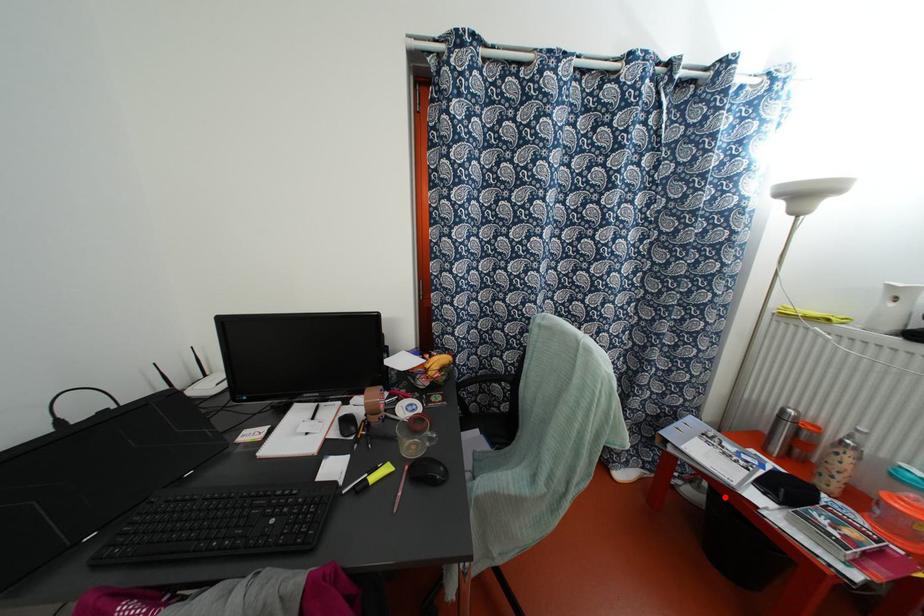
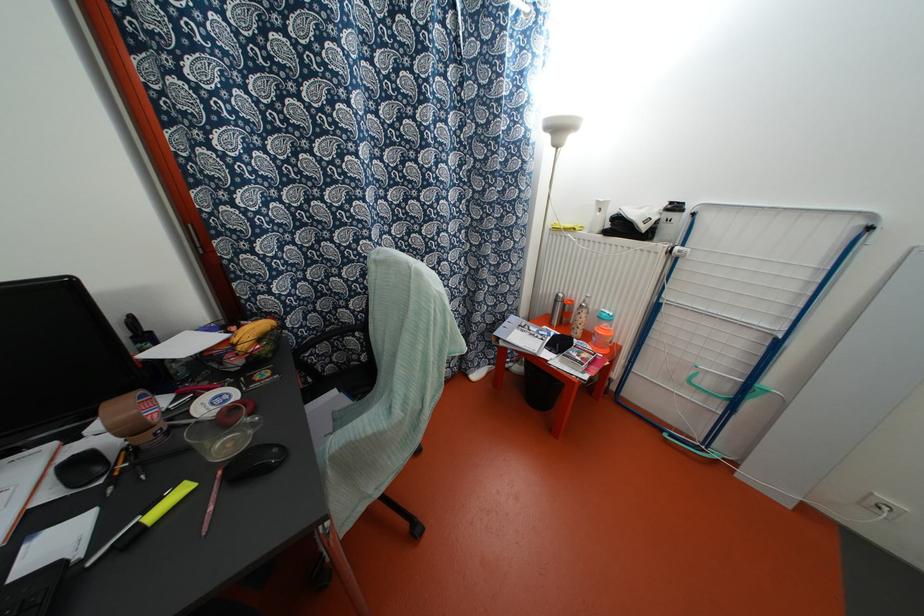
Locate, in the second image, the point that corresponds to the highlighted location in the first image.

(531, 362)